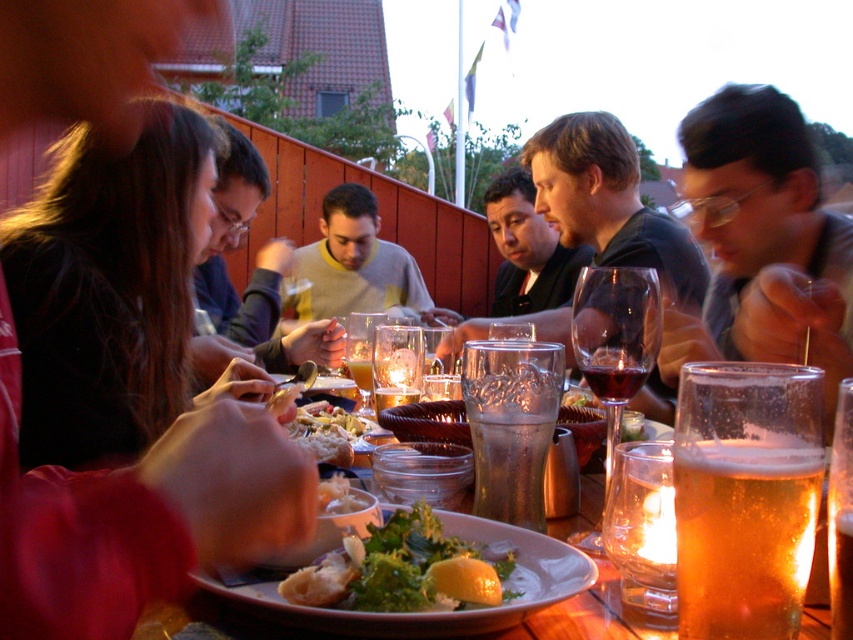
You are a server at the restaurant and need to place a new drink order for the person seated at the position marked by the point at point (x=347, y=422). The drink is 0.3 meters in diameter. Is there enough space on the table between the existing items to accommodate the drink without touching anything?

The existing items at the table are 1.10 meters apart, which is more than enough space to place the drink of 0.3 meters in diameter without it touching anything.

You are a waiter at the outdoor table and need to deliver a drink to the person wearing the black shirt at center. The drink needs to be placed on the table near them. Where should you place the drink relative to the green leafy salad at center?

The green leafy salad at center is to the left of the black shirt at center, so you should place the drink to the right of the green leafy salad at center to position it near the black shirt at center.

You are a server at the outdoor table and need to replace the translucent glass beer at table center and the dark red glass at center with larger ones. Which glass should you replace first based on their sizes?

The translucent glass beer at table center has a smaller size compared to dark red glass at center, so you should replace the translucent glass beer at table center first since it is smaller and needs a larger replacement.